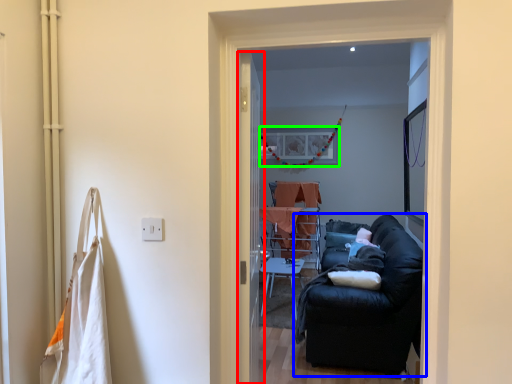
Question: Which object is positioned closest to screen door (highlighted by a red box)? Select from studio couch (highlighted by a blue box) and picture frame (highlighted by a green box).

Choices:
 (A) studio couch
 (B) picture frame

Answer: (A)